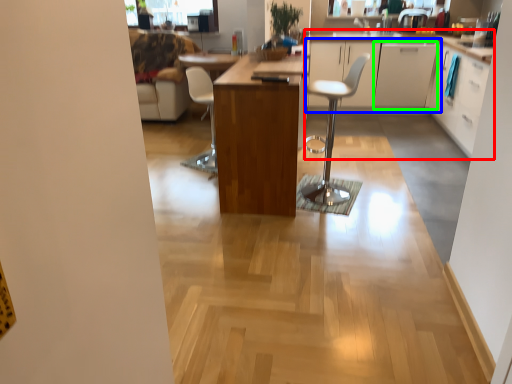
Question: Considering the real-world distances, which object is closest to cabinetry (highlighted by a red box)? cabinetry (highlighted by a blue box) or cabinetry (highlighted by a green box).

Choices:
 (A) cabinetry
 (B) cabinetry

Answer: (A)